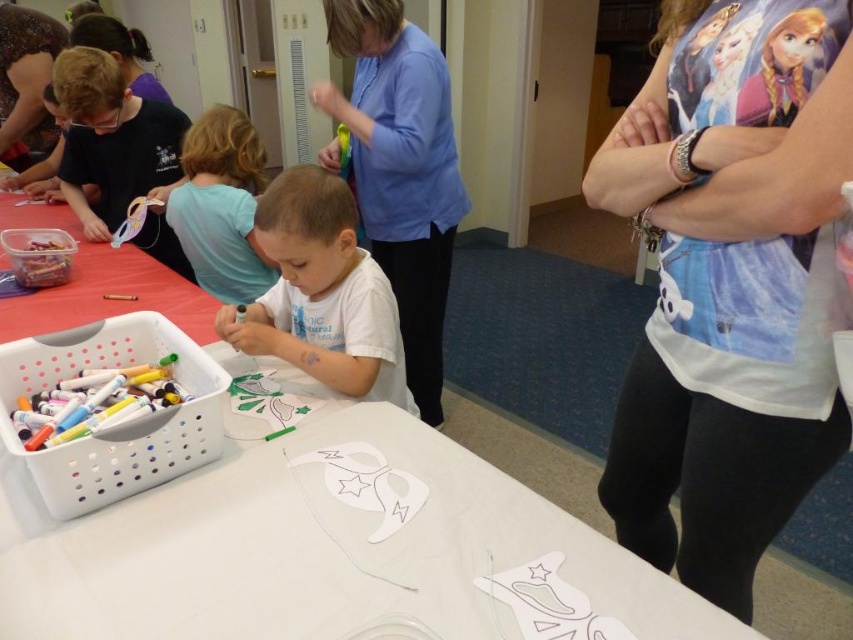
Question: Can you confirm if white matte shirt at center is wider than light blue shirt at upper left?

Choices:
 (A) yes
 (B) no

Answer: (A)

Question: Which point is closer to the camera?

Choices:
 (A) white matte shirt at center
 (B) blue shirt at upper center
 (C) white printed shirt at upper right
 (D) white paper table at center

Answer: (C)

Question: Which of the following is the closest to the observer?

Choices:
 (A) (241, 193)
 (B) (694, 40)

Answer: (B)

Question: Is blue shirt at upper center to the left of white matte shirt at center from the viewer's perspective?

Choices:
 (A) yes
 (B) no

Answer: (B)

Question: Is white printed shirt at upper right to the left of blue shirt at upper center from the viewer's perspective?

Choices:
 (A) no
 (B) yes

Answer: (A)

Question: Estimate the real-world distances between objects in this image. Which object is farther from the white printed shirt at upper right?

Choices:
 (A) light blue shirt at upper left
 (B) white paper table at center
 (C) white matte shirt at center

Answer: (A)